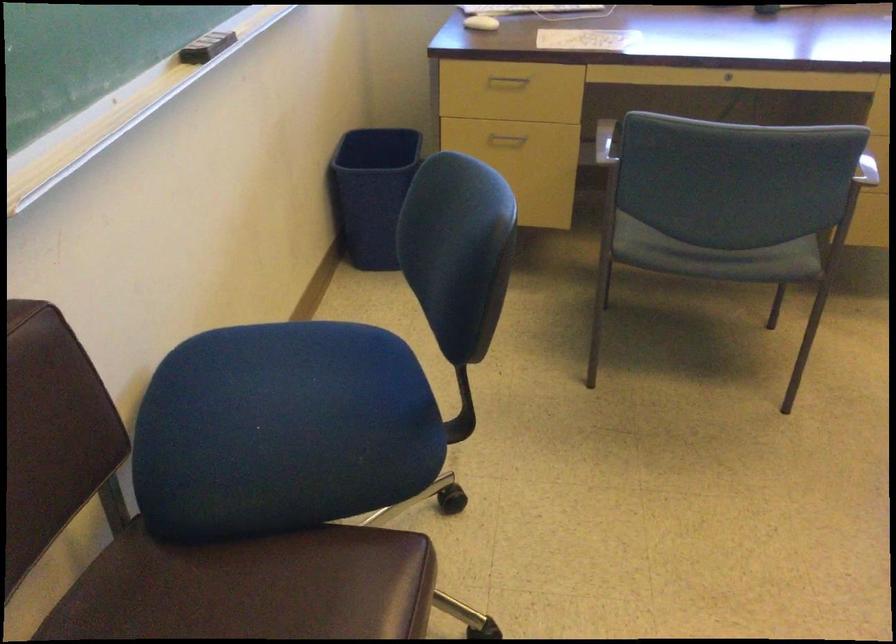
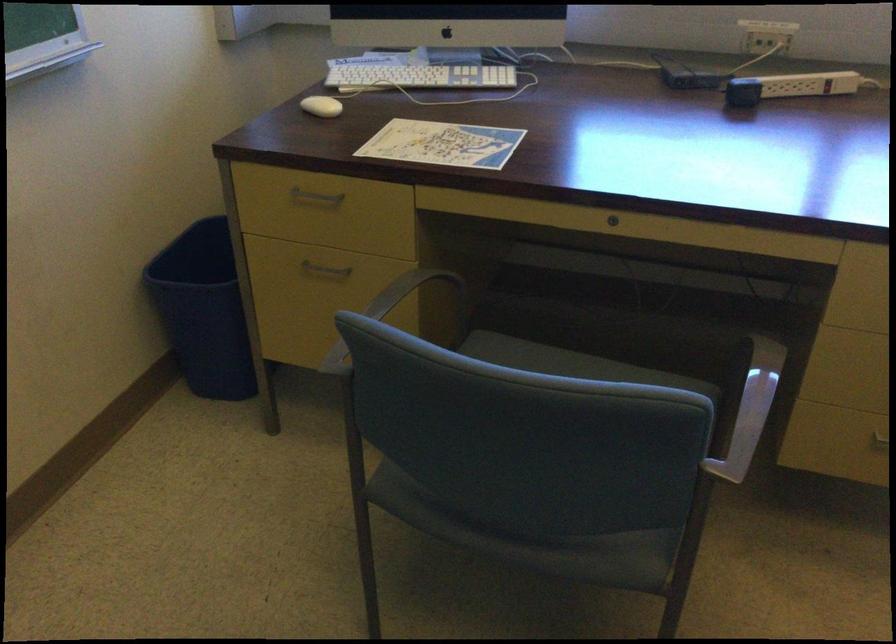
In the second image, find the point that corresponds to (x=504, y=136) in the first image.

(324, 269)